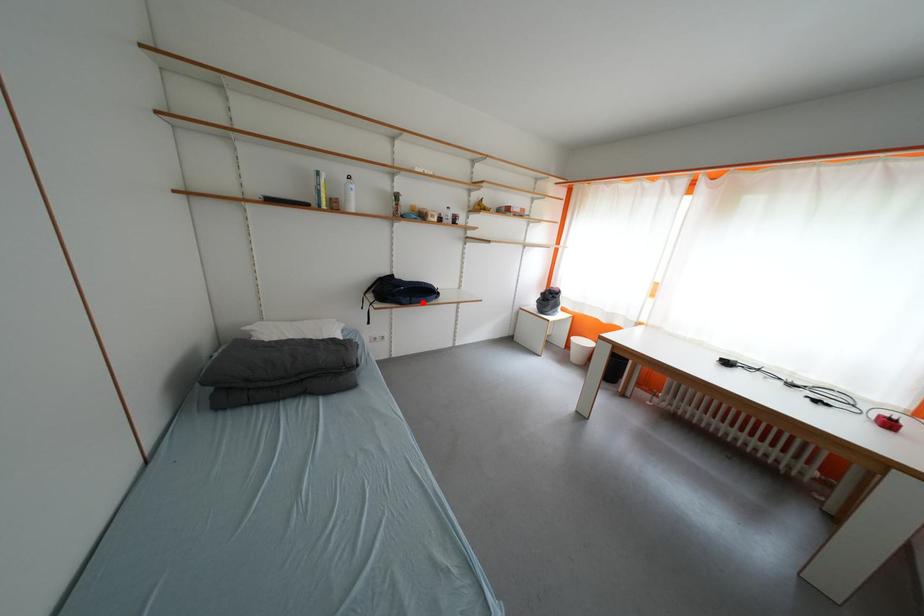
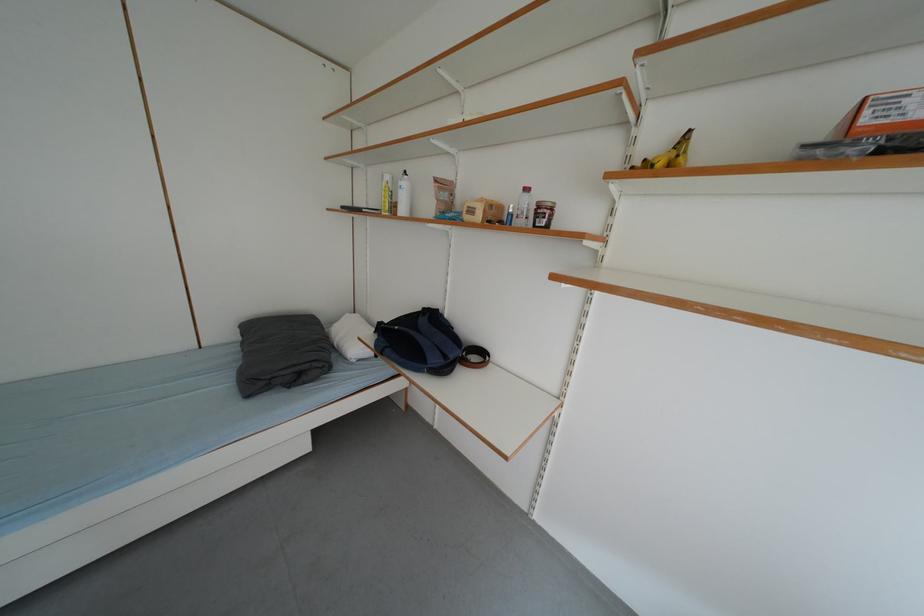
The point at the highlighted location is marked in the first image. Where is the corresponding point in the second image?

(396, 354)